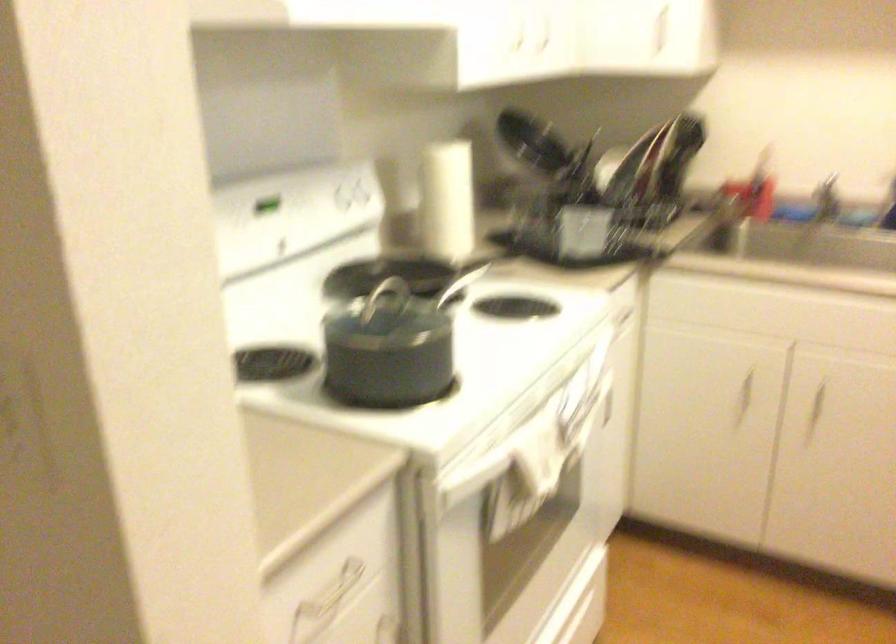
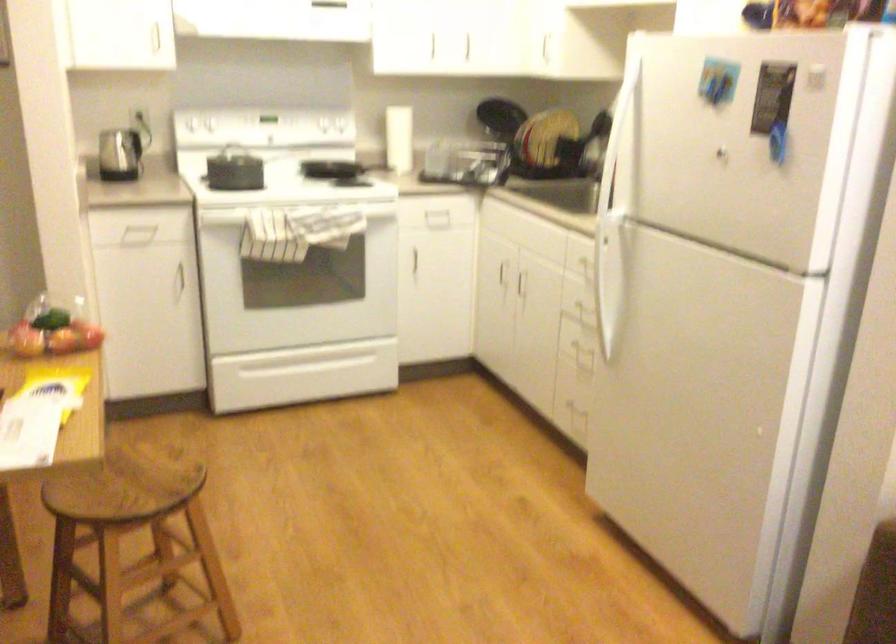
Question: I am providing you with two images of the same scene from different viewpoints. Please identify which objects are invisible in image2.

Choices:
 (A) kettle handle
 (B) white stove knob
 (C) white oven door handle
 (D) none of these

Answer: (D)